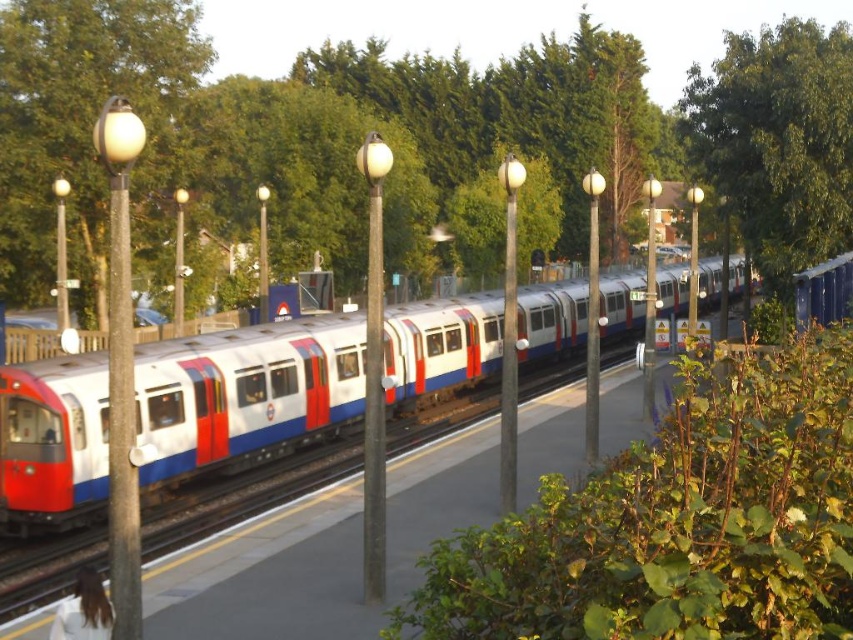
Question: Which is nearer to the matte white train at center?

Choices:
 (A) green leafy tree at upper right
 (B) green leafy tree at center

Answer: (A)

Question: Estimate the real-world distances between objects in this image. Which object is closer to the matte white train at center?

Choices:
 (A) green leafy tree at upper right
 (B) green leafy tree at center

Answer: (A)

Question: Is green leafy tree at upper left bigger than green leafy tree at upper right?

Choices:
 (A) yes
 (B) no

Answer: (B)

Question: Observing the image, what is the correct spatial positioning of green leafy tree at center in reference to green leafy tree at upper right?

Choices:
 (A) below
 (B) above

Answer: (A)

Question: Does green leafy tree at upper left appear under green leafy tree at upper right?

Choices:
 (A) no
 (B) yes

Answer: (B)

Question: Which point is closer to the camera?

Choices:
 (A) green leafy tree at upper right
 (B) green leafy tree at upper left
 (C) green leafy tree at center
 (D) matte white train at center

Answer: (D)